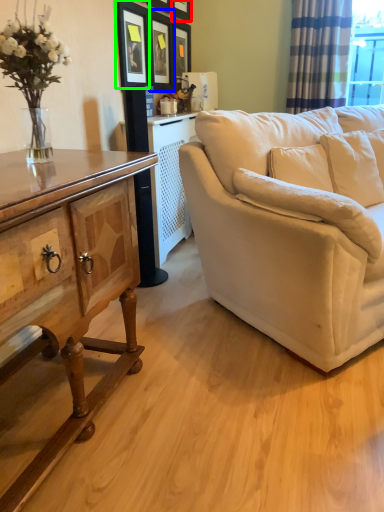
Question: Which object is the farthest from picture frame (highlighted by a red box)? Choose among these: picture frame (highlighted by a blue box) or picture frame (highlighted by a green box).

Choices:
 (A) picture frame
 (B) picture frame

Answer: (B)